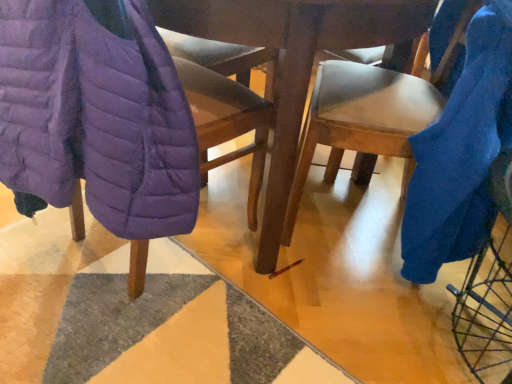
What are the coordinates of `free space between blue fabric chair at right, positioned as the 2th chair in left-to-right order, and blue fuzzy blanket at right, the first blanket positioned from the right` in the screenshot? It's located at (350, 181).